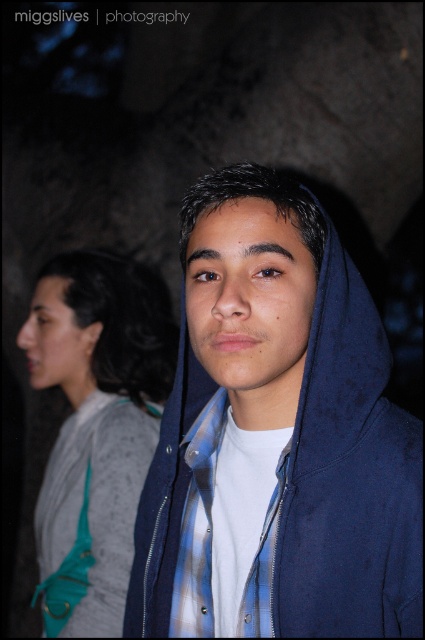
You are a photographer trying to capture a candid shot of the blue plaid shirt at center and the teal fabric purse at left. If your camera has a maximum focus range of 30 inches, will you be able to focus on both subjects simultaneously?

The teal fabric purse at left and blue plaid shirt at center are 30.70 inches apart from each other, which exceeds the camera maximum focus range of 30 inches. Therefore, you cannot focus on both subjects simultaneously.